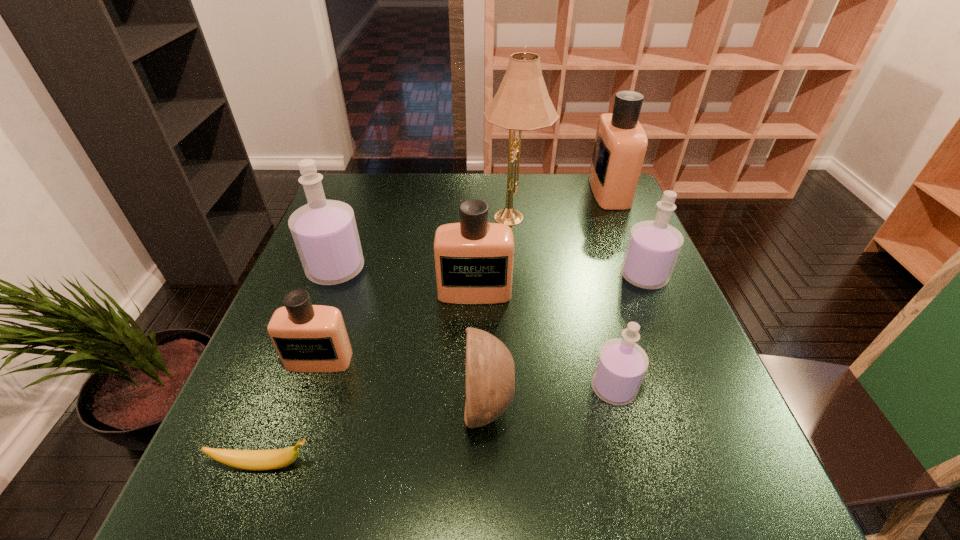
I want to click on free spot between the tallest object and the rightmost purple perfume, so click(x=580, y=247).

Locate an element on the screen. vacant area that lies between the lampshade and the bowl is located at coordinates (501, 311).

Locate an element on the screen. free space between the bowl and the third object from right to left is located at coordinates (551, 397).

In order to click on free point between the beige lampshade and the biggest purple perfume in this screenshot , I will do `click(425, 243)`.

This screenshot has height=540, width=960. Find the location of `free space between the banana and the beige lampshade`. free space between the banana and the beige lampshade is located at coordinates (x=391, y=341).

You are a GUI agent. You are given a task and a screenshot of the screen. Output one action in this format:
    pyautogui.click(x=<x>, y=<y>)
    Task: Click on the blank region between the rightmost purple perfume and the rightmost beige perfume
    
    Given the screenshot: What is the action you would take?
    pyautogui.click(x=627, y=234)

You are a GUI agent. You are given a task and a screenshot of the screen. Output one action in this format:
    pyautogui.click(x=<x>, y=<y>)
    Task: Click on the vacant space that's between the bowl and the farthest perfume
    The height and width of the screenshot is (540, 960).
    Given the screenshot: What is the action you would take?
    pyautogui.click(x=548, y=299)

I want to click on the fifth closest object to the bowl, so click(x=325, y=234).

Select which object appears as the seventh closest to the nearest beige perfume. Please provide its 2D coordinates. Your answer should be formatted as a tuple, i.e. [(x, y)], where the tuple contains the x and y coordinates of a point satisfying the conditions above.

[(653, 247)]

Point out which perfume is positioned as the third nearest to the bowl. Please provide its 2D coordinates. Your answer should be formatted as a tuple, i.e. [(x, y)], where the tuple contains the x and y coordinates of a point satisfying the conditions above.

[(308, 338)]